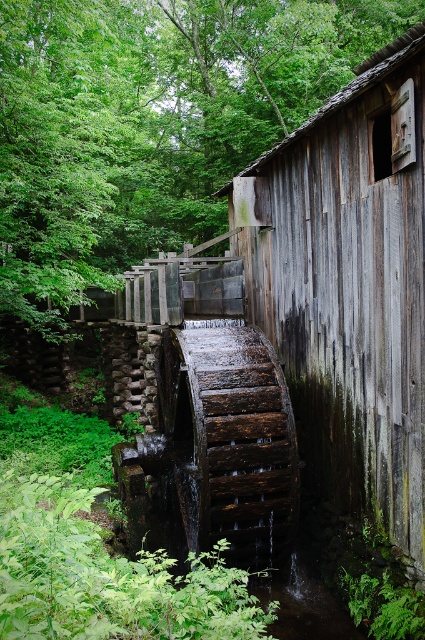
Question: Is green leafy forest at upper left to the right of weathered wood hut at center from the viewer's perspective?

Choices:
 (A) yes
 (B) no

Answer: (B)

Question: Is green leafy forest at upper left thinner than weathered wood hut at center?

Choices:
 (A) yes
 (B) no

Answer: (B)

Question: Which point is closer to the camera?

Choices:
 (A) green leafy forest at upper left
 (B) weathered wood hut at center

Answer: (B)

Question: Can you confirm if green leafy forest at upper left is positioned to the left of weathered wood hut at center?

Choices:
 (A) yes
 (B) no

Answer: (A)

Question: Which of the following is the closest to the observer?

Choices:
 (A) (280, 236)
 (B) (212, 209)

Answer: (A)